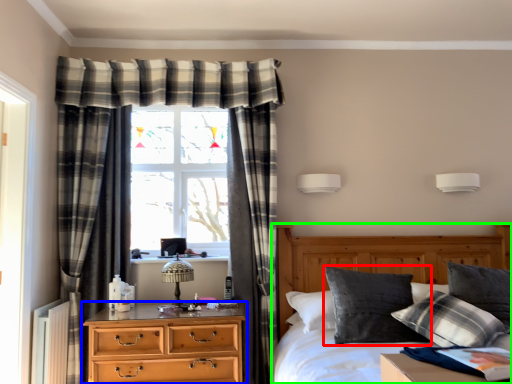
Question: Which is farther away from pillow (highlighted by a red box)? chest of drawers (highlighted by a blue box) or bed (highlighted by a green box)?

Choices:
 (A) chest of drawers
 (B) bed

Answer: (A)